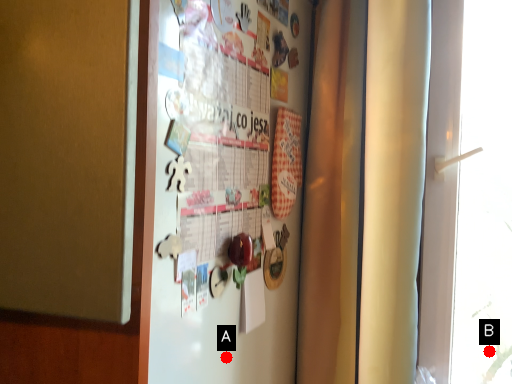
Question: Two points are circled on the image, labeled by A and B beside each circle. Which point is closer to the camera taking this photo?

Choices:
 (A) A is closer
 (B) B is closer

Answer: (A)